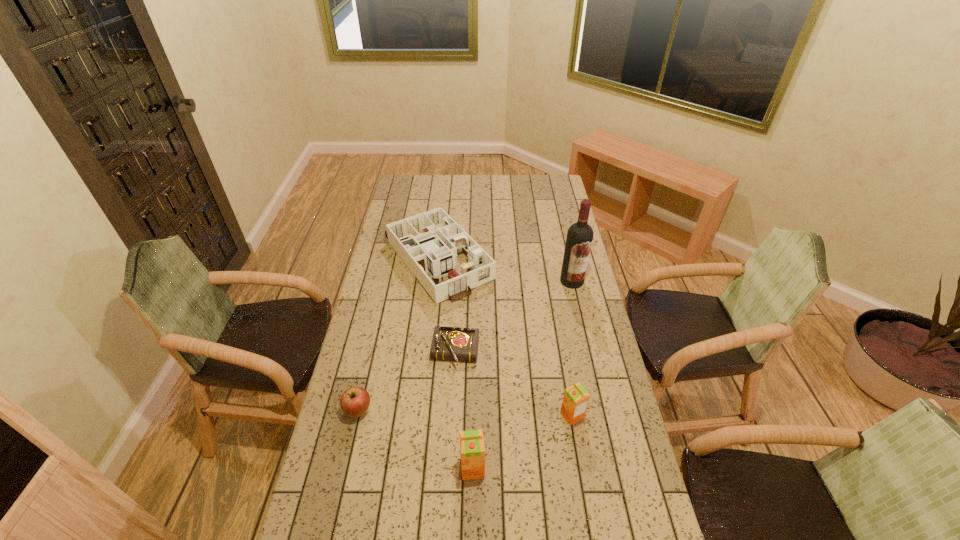
I want to click on vacant region located 0.120m on the front of the second tallest object, so click(471, 526).

This screenshot has height=540, width=960. In order to click on vacant space located 0.240m on the front of the third tallest object in this screenshot , I will do `click(588, 507)`.

You are a GUI agent. You are given a task and a screenshot of the screen. Output one action in this format:
    pyautogui.click(x=<x>, y=<y>)
    Task: Click on the vacant space located 0.250m on the back of the dollhouse
    The height and width of the screenshot is (540, 960).
    Given the screenshot: What is the action you would take?
    pyautogui.click(x=444, y=193)

Where is `vacant space situated on the label of the rightmost object`? This screenshot has height=540, width=960. vacant space situated on the label of the rightmost object is located at coordinates (588, 350).

You are a GUI agent. You are given a task and a screenshot of the screen. Output one action in this format:
    pyautogui.click(x=<x>, y=<y>)
    Task: Click on the free spot located 0.340m on the back of the apple
    The width and height of the screenshot is (960, 540).
    Given the screenshot: What is the action you would take?
    pyautogui.click(x=379, y=322)

This screenshot has width=960, height=540. What are the coordinates of `vacant space located 0.220m on the left of the fourth nearest object` in the screenshot? It's located at (370, 353).

You are a GUI agent. You are given a task and a screenshot of the screen. Output one action in this format:
    pyautogui.click(x=<x>, y=<y>)
    Task: Click on the dollhouse situated at the left edge
    The width and height of the screenshot is (960, 540).
    Given the screenshot: What is the action you would take?
    [x=422, y=248]

The image size is (960, 540). Identify the location of apple present at the left edge. (354, 402).

Where is `orange juice that is at the right edge`? The width and height of the screenshot is (960, 540). orange juice that is at the right edge is located at coordinates (575, 401).

You are a GUI agent. You are given a task and a screenshot of the screen. Output one action in this format:
    pyautogui.click(x=<x>, y=<y>)
    Task: Click on the wine bottle that is at the right edge
    
    Given the screenshot: What is the action you would take?
    pyautogui.click(x=579, y=239)